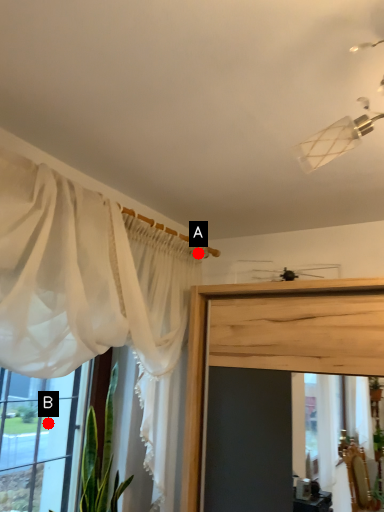
Question: Two points are circled on the image, labeled by A and B beside each circle. Which point appears closest to the camera in this image?

Choices:
 (A) A is closer
 (B) B is closer

Answer: (B)